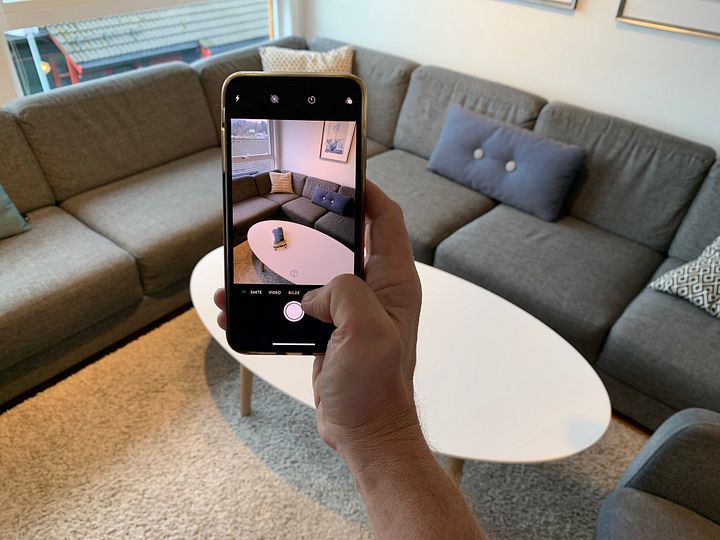
I want to click on white table, so click(x=523, y=367).